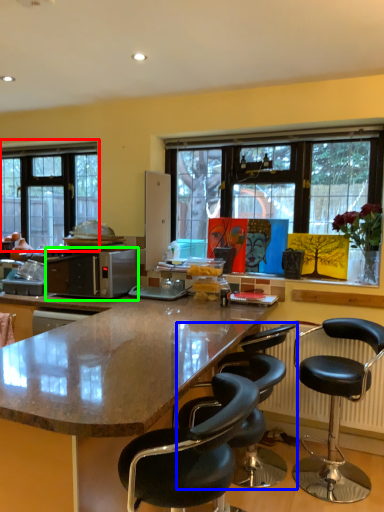
Question: Based on their relative distances, which object is farther from window (highlighted by a red box)? Choose from chair (highlighted by a blue box) and microwave oven (highlighted by a green box).

Choices:
 (A) chair
 (B) microwave oven

Answer: (A)